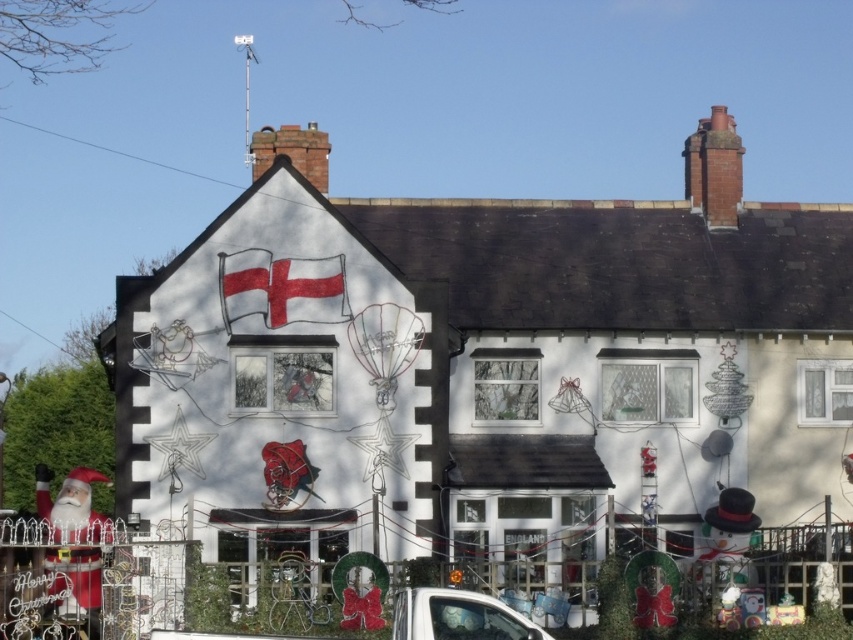
You are a delivery person trying to locate the correct address. You see the house with a red matte flag at upper left and a red fabric santa claus at lower left. Which object should you look for first if you want to find the entrance to the house?

The red fabric santa claus at lower left is lower than the red matte flag at upper left, so the entrance is likely near the red fabric santa claus at lower left since it is positioned lower on the facade.

You are standing 60 meters away from the red matte flag at upper left. Can you reach it without moving closer?

The red matte flag at upper left is 64.77 meters away from the viewer. Since you are only 60 meters away, you are already closer than the flag, so you can reach it without moving closer.

You are a delivery person approaching the house and need to park your white glossy car at lower center. There is a red matte flag at upper left hanging above the driveway entrance. To avoid hitting the flag, which direction should you turn your car as you enter the driveway?

The red matte flag at upper left is to the left of the white glossy car at lower center, so you should turn right to avoid hitting the flag as you enter the driveway.